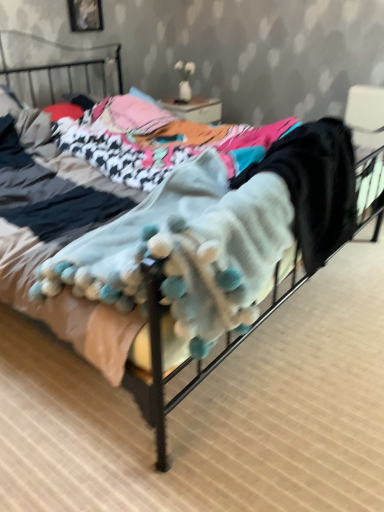
This screenshot has height=512, width=384. What do you see at coordinates (315, 185) in the screenshot?
I see `white fluffy blanket at right` at bounding box center [315, 185].

Where is `white fluffy blanket at right`? The image size is (384, 512). white fluffy blanket at right is located at coordinates click(x=315, y=185).

Identify the location of white fluffy blanket at right. The width and height of the screenshot is (384, 512). (315, 185).